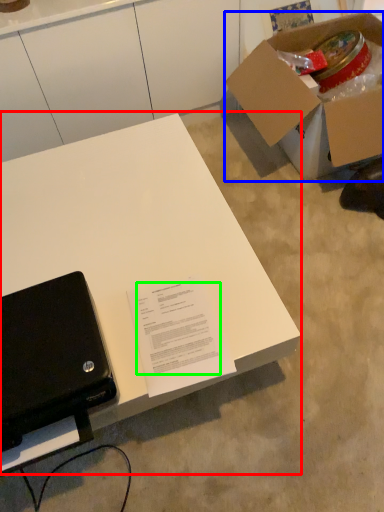
Question: Which object is the farthest from desk (highlighted by a red box)? Choose among these: box (highlighted by a blue box) or writing (highlighted by a green box).

Choices:
 (A) box
 (B) writing

Answer: (A)